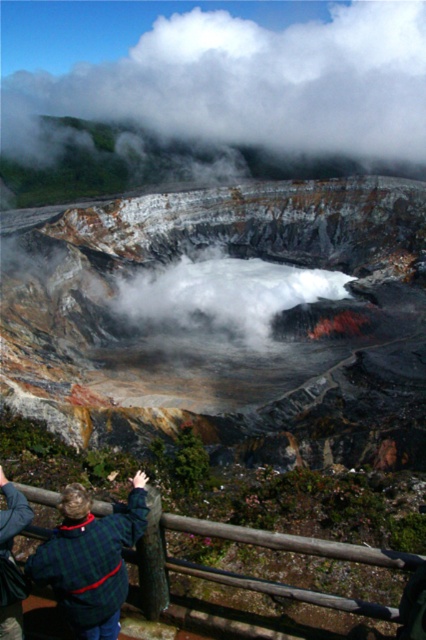
You are standing at the viewpoint overlooking the volcanic crater. You notice a green plaid sweater at lower left and a brown wooden rail at lower center. Which object is nearer to you?

The green plaid sweater at lower left is closer to the viewer than the brown wooden rail at lower center.

You are standing at the wooden railing at the viewpoint. You notice two points marked on the ground ahead of you. One is labeled as point (279, 532) and the other as point (17, 620). If you want to walk towards the crater edge, which point should you avoid stepping on to stay safe?

You should avoid stepping on point (279, 532) because it is behind point (17, 620), meaning it is farther from the railing and closer to the crater edge, which might be unsafe.